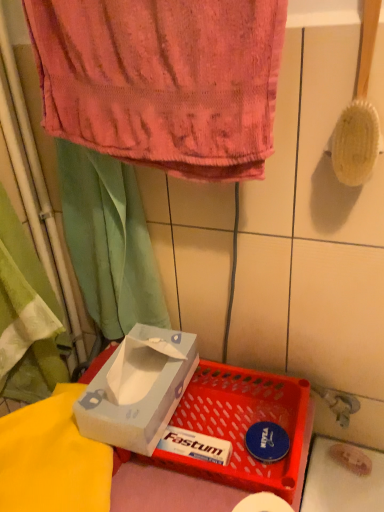
This screenshot has height=512, width=384. What do you see at coordinates (358, 114) in the screenshot?
I see `wooden bristles brush at upper right` at bounding box center [358, 114].

This screenshot has width=384, height=512. I want to click on translucent plastic tray at lower center, so click(x=244, y=426).

At what (x,y) coordinates should I click in order to perform the action: click on light blue cardboard tissue box at center. Please return your answer as a coordinate pair (x, y). Looking at the image, I should click on tap(138, 389).

This screenshot has height=512, width=384. What do you see at coordinates (138, 389) in the screenshot?
I see `light blue cardboard tissue box at center` at bounding box center [138, 389].

The height and width of the screenshot is (512, 384). Identify the location of wooden bristles brush at upper right. (358, 114).

Does light blue cardboard tissue box at center turn towards wooden bristles brush at upper right?

No.

Would you say light blue cardboard tissue box at center contains wooden bristles brush at upper right?

No, wooden bristles brush at upper right is located outside of light blue cardboard tissue box at center.

At what (x,y) coordinates should I click in order to perform the action: click on brush above the light blue cardboard tissue box at center (from a real-world perspective). Please return your answer as a coordinate pair (x, y). Image resolution: width=384 pixels, height=512 pixels. Looking at the image, I should click on (358, 114).

Is translucent plastic tray at lower center oriented towards pink terry cloth towel at upper center?

No, translucent plastic tray at lower center does not turn towards pink terry cloth towel at upper center.

Is translucent plastic tray at lower center bigger or smaller than pink terry cloth towel at upper center?

In the image, translucent plastic tray at lower center appears to be smaller than pink terry cloth towel at upper center.

From the image's perspective, is translucent plastic tray at lower center on pink terry cloth towel at upper center?

No, from the image's perspective, translucent plastic tray at lower center is not above pink terry cloth towel at upper center.

Considering the relative sizes of translucent plastic tray at lower center and pink terry cloth towel at upper center in the image provided, is translucent plastic tray at lower center shorter than pink terry cloth towel at upper center?

Indeed, translucent plastic tray at lower center has a lesser height compared to pink terry cloth towel at upper center.

Is point (254, 373) closer to camera compared to point (347, 156)?

That is False.

Between translucent plastic tray at lower center and wooden bristles brush at upper right, which one has smaller size?

wooden bristles brush at upper right is smaller.

Does translucent plastic tray at lower center appear on the left side of wooden bristles brush at upper right?

Indeed, translucent plastic tray at lower center is positioned on the left side of wooden bristles brush at upper right.

Is light blue cardboard tissue box at center far away from translucent plastic tray at lower center?

They are positioned close to each other.

Is translucent plastic tray at lower center completely or partially inside light blue cardboard tissue box at center?

No, translucent plastic tray at lower center is not a part of light blue cardboard tissue box at center.

Where is `basket on the right side of light blue cardboard tissue box at center`? The image size is (384, 512). basket on the right side of light blue cardboard tissue box at center is located at coordinates (244, 426).

Which object is wider, light blue cardboard tissue box at center or translucent plastic tray at lower center?

translucent plastic tray at lower center is wider.

Is wooden bristles brush at upper right directly adjacent to light blue cardboard tissue box at center?

No, wooden bristles brush at upper right is not making contact with light blue cardboard tissue box at center.

Which of these two, wooden bristles brush at upper right or light blue cardboard tissue box at center, stands shorter?

With less height is light blue cardboard tissue box at center.

Based on the photo, is wooden bristles brush at upper right at the right side of light blue cardboard tissue box at center?

Yes.

Considering the relative sizes of translucent plastic tray at lower center and light blue cardboard tissue box at center in the image provided, is translucent plastic tray at lower center smaller than light blue cardboard tissue box at center?

Indeed, translucent plastic tray at lower center has a smaller size compared to light blue cardboard tissue box at center.

Which object is more forward, translucent plastic tray at lower center or light blue cardboard tissue box at center?

translucent plastic tray at lower center.

What's the angular difference between translucent plastic tray at lower center and light blue cardboard tissue box at center's facing directions?

The facing directions of translucent plastic tray at lower center and light blue cardboard tissue box at center are 0.886 degrees apart.

Is translucent plastic tray at lower center facing away from light blue cardboard tissue box at center?

No.

Is pink terry cloth towel at upper center oriented towards green fabric curtain at upper left?

No, pink terry cloth towel at upper center is not aimed at green fabric curtain at upper left.

Is there a large distance between pink terry cloth towel at upper center and green fabric curtain at upper left?

pink terry cloth towel at upper center is near green fabric curtain at upper left, not far away.

Is pink terry cloth towel at upper center taller or shorter than green fabric curtain at upper left?

pink terry cloth towel at upper center is shorter than green fabric curtain at upper left.

From a real-world perspective, relative to green fabric curtain at upper left, is pink terry cloth towel at upper center vertically above or below?

Clearly, from a real-world perspective, pink terry cloth towel at upper center is above green fabric curtain at upper left.

The width and height of the screenshot is (384, 512). Identify the location of box below the wooden bristles brush at upper right (from a real-world perspective). (138, 389).

What are the coordinates of `towel above the translucent plastic tray at lower center (from a real-world perspective)` in the screenshot? It's located at (162, 80).

Based on their spatial positions, is translucent plastic tray at lower center or pink terry cloth towel at upper center closer to green fabric curtain at upper left?

Based on the image, pink terry cloth towel at upper center appears to be nearer to green fabric curtain at upper left.

From the image, which object appears to be farther from translucent plastic tray at lower center, pink terry cloth towel at upper center or green fabric curtain at upper left?

Among the two, pink terry cloth towel at upper center is located further to translucent plastic tray at lower center.

Looking at the image, which one is located closer to wooden bristles brush at upper right, light blue cardboard tissue box at center or pink terry cloth towel at upper center?

pink terry cloth towel at upper center is closer to wooden bristles brush at upper right.

From the image, which object appears to be nearer to wooden bristles brush at upper right, light blue cardboard tissue box at center or translucent plastic tray at lower center?

Among the two, translucent plastic tray at lower center is located nearer to wooden bristles brush at upper right.

Estimate the real-world distances between objects in this image. Which object is further from green fabric curtain at upper left, pink terry cloth towel at upper center or wooden bristles brush at upper right?

wooden bristles brush at upper right.

Based on their spatial positions, is wooden bristles brush at upper right or light blue cardboard tissue box at center further from pink terry cloth towel at upper center?

light blue cardboard tissue box at center.

Looking at the image, which one is located further to wooden bristles brush at upper right, pink terry cloth towel at upper center or translucent plastic tray at lower center?

translucent plastic tray at lower center is positioned further to the anchor wooden bristles brush at upper right.

Which object lies further to the anchor point light blue cardboard tissue box at center, translucent plastic tray at lower center or green fabric curtain at upper left?

Among the two, green fabric curtain at upper left is located further to light blue cardboard tissue box at center.

Identify the location of towel between green fabric curtain at upper left and wooden bristles brush at upper right. (162, 80).

Where is `box that lies between green fabric curtain at upper left and translucent plastic tray at lower center from top to bottom`? This screenshot has height=512, width=384. box that lies between green fabric curtain at upper left and translucent plastic tray at lower center from top to bottom is located at coordinates (138, 389).

The height and width of the screenshot is (512, 384). In order to click on box between wooden bristles brush at upper right and translucent plastic tray at lower center in the vertical direction in this screenshot , I will do `click(138, 389)`.

Identify the location of curtain between pink terry cloth towel at upper center and light blue cardboard tissue box at center in the up-down direction. (109, 241).